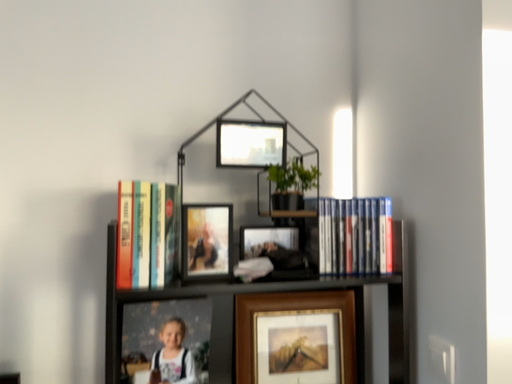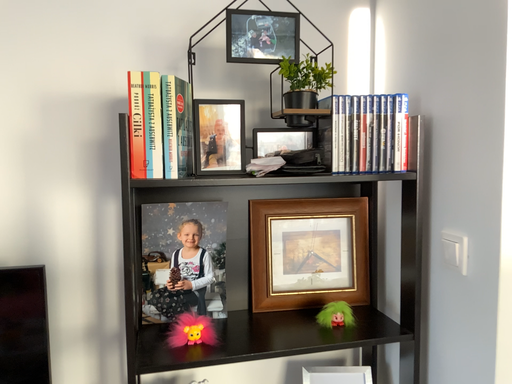
Question: How did the camera likely rotate when shooting the video?

Choices:
 (A) rotated upward
 (B) rotated downward

Answer: (B)